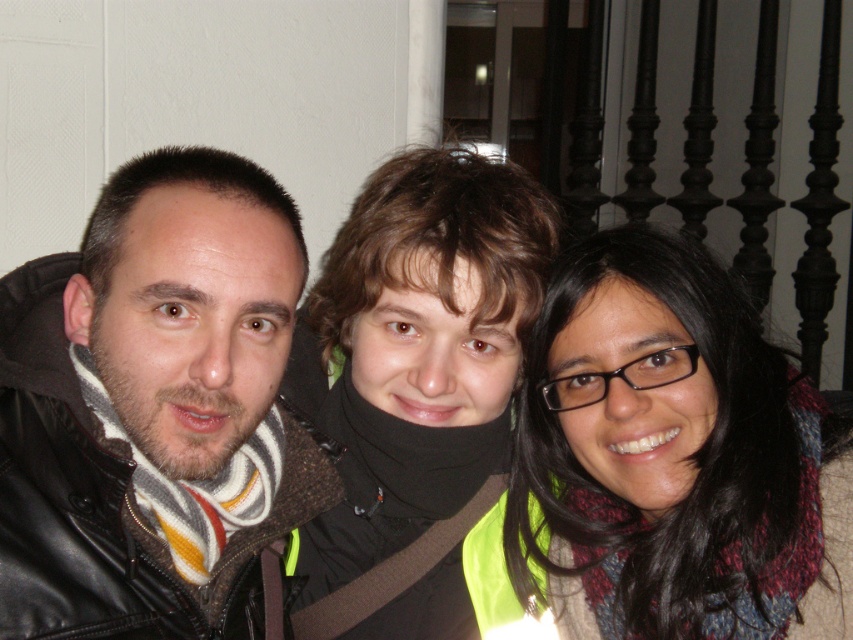
You are a fashion designer analyzing the scarves in the photo. The multicolored scarf at right and the black matte scarf at center are both part of your new collection. Based on the image, which scarf has a greater width?

The multicolored scarf at right might be wider than black matte scarf at center according to the description.

You are a photographer trying to adjust the lighting for a group photo. You notice the leather jacket at left and the multicolored scarf at right. Which object should you focus on first if you want to ensure both are properly lit, considering their sizes?

The leather jacket at left should be focused on first since it is taller than the multicolored scarf at right, making it a larger subject that requires more attention to lighting.

You are trying to decide which item to buy between the leather jacket at left and the multicolored scarf at right. Based on their sizes in the image, which item is wider?

The multicolored scarf at right is wider than the leather jacket at left.